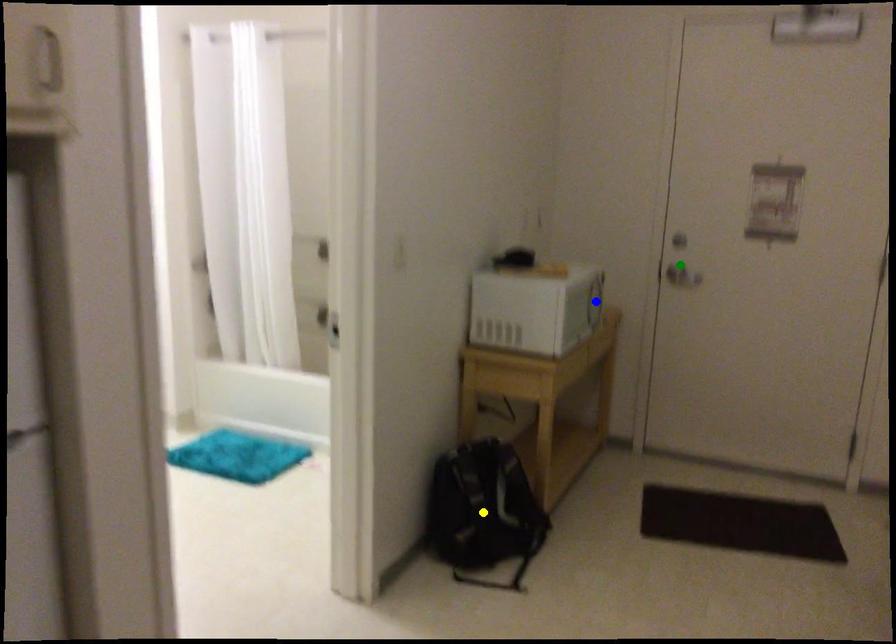
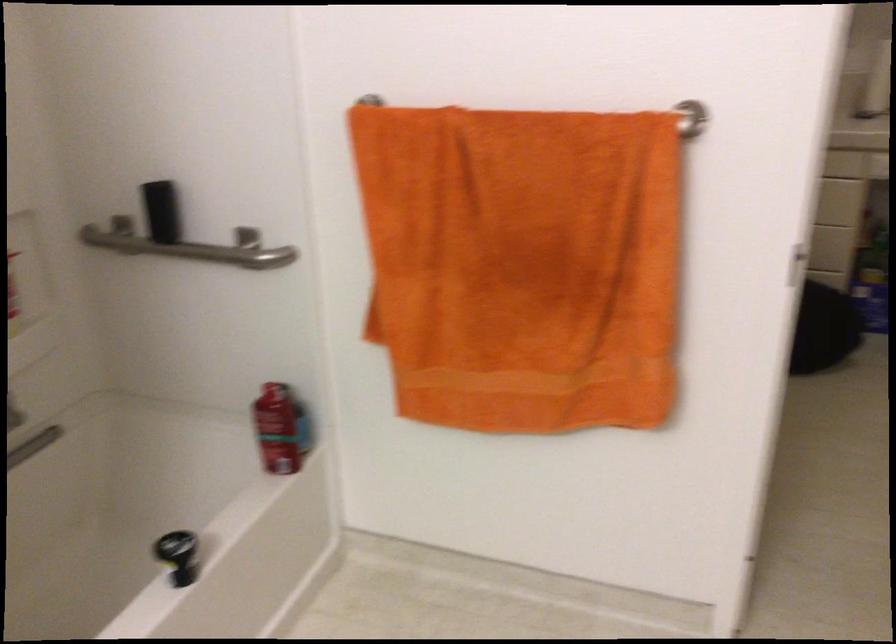
I am providing you with two images of the same scene from different viewpoints. Three points are marked in image1. Which point corresponds to a part or object that is occluded in image2?In image1, three points are marked. Which of them correspond to a part or object that is occluded in image2?Among the three points shown in image1, which one corresponds to a part or object that is no longer visible due to occlusion in image2?

yellow point, blue point, green point